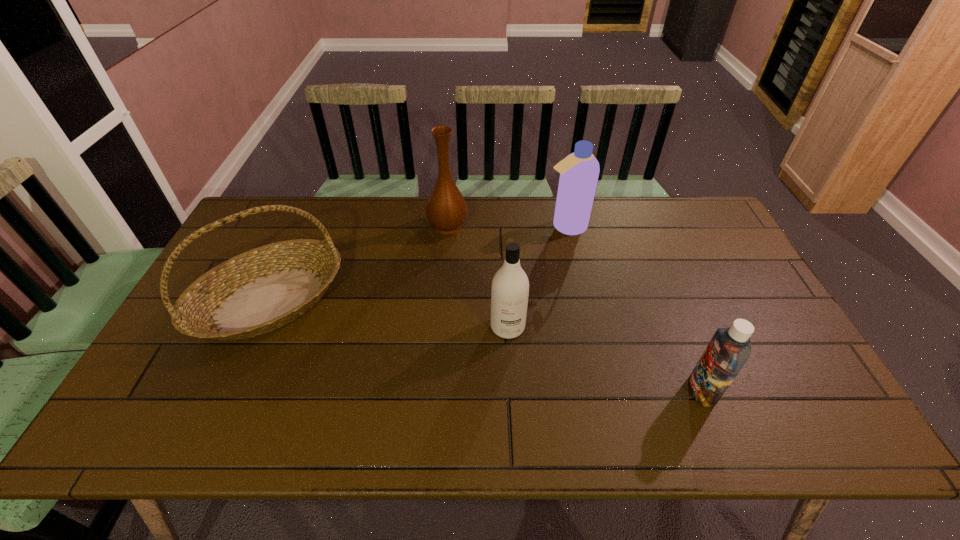
You are a GUI agent. You are given a task and a screenshot of the screen. Output one action in this format:
    pyautogui.click(x=<x>, y=<y>)
    Task: Click on the vacant point located between the rightmost shampoo and the fourth object from left to right
    This screenshot has width=960, height=540.
    Given the screenshot: What is the action you would take?
    pyautogui.click(x=634, y=309)

Where is `free spot between the third object from left to right and the rightmost shampoo`? This screenshot has height=540, width=960. free spot between the third object from left to right and the rightmost shampoo is located at coordinates (605, 359).

This screenshot has width=960, height=540. I want to click on free space between the third object from right to left and the rightmost shampoo, so click(605, 359).

Select which object is the third closest to the second shampoo from right to left. Please provide its 2D coordinates. Your answer should be formatted as a tuple, i.e. [(x, y)], where the tuple contains the x and y coordinates of a point satisfying the conditions above.

[(729, 349)]

At what (x,y) coordinates should I click in order to perform the action: click on object that stands as the closest to the third object from left to right. Please return your answer as a coordinate pair (x, y). The height and width of the screenshot is (540, 960). Looking at the image, I should click on (446, 210).

Identify the location of the second closest shampoo to the second object from right to left. (729, 349).

Where is `shampoo that stands as the second closest to the vase`? shampoo that stands as the second closest to the vase is located at coordinates (510, 287).